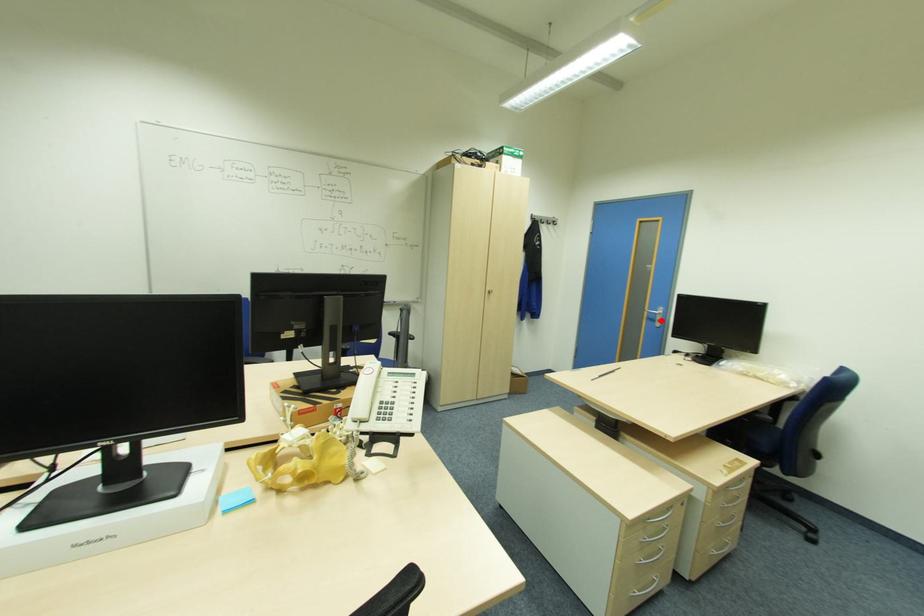
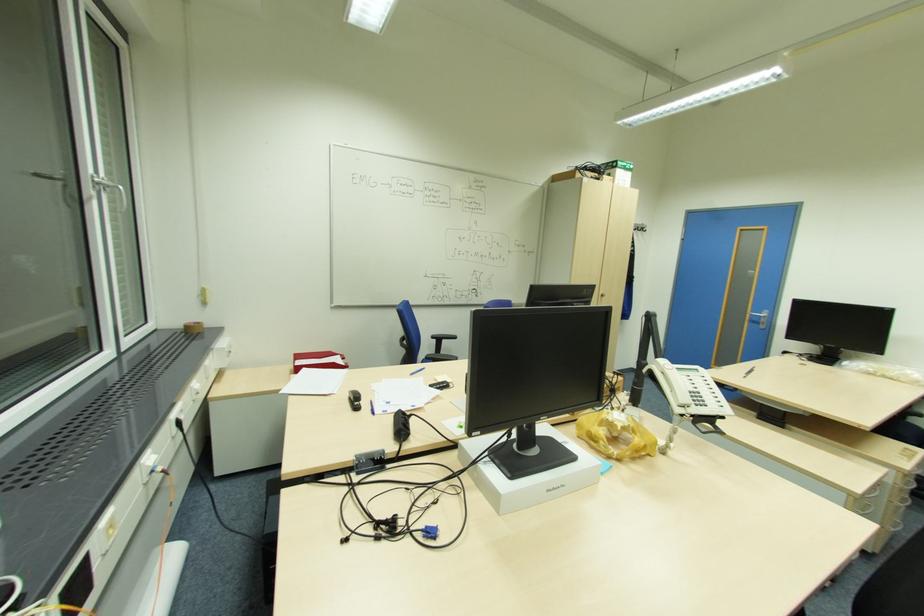
Find the pixel in the second image that matches the highlighted location in the first image.

(766, 323)